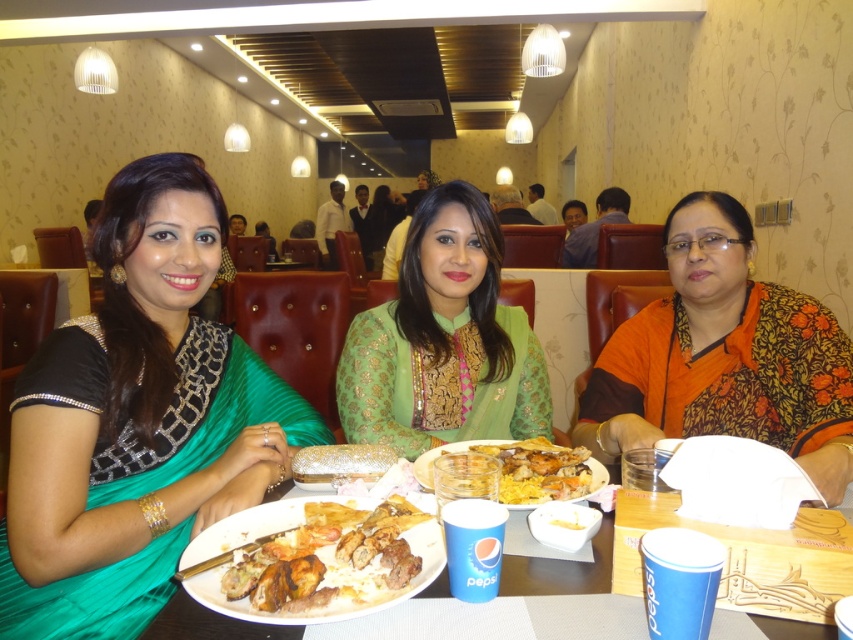
Consider the image. Can you confirm if grilled meat at center is thinner than white paper plate at center?

Correct, grilled meat at center's width is less than white paper plate at center's.

Can you confirm if grilled meat at center is positioned above white paper plate at center?

Yes.

Is point (418, 586) positioned in front of point (524, 586)?

Yes, it is.

Find the location of a particular element. The width and height of the screenshot is (853, 640). grilled meat at center is located at coordinates (338, 573).

Can you confirm if green silk saree at center is wider than grilled meat at center?

Correct, the width of green silk saree at center exceeds that of grilled meat at center.

Is green silk saree at center shorter than grilled meat at center?

In fact, green silk saree at center may be taller than grilled meat at center.

This screenshot has width=853, height=640. I want to click on green silk saree at center, so click(x=137, y=420).

Is grilled meat at center positioned behind translucent glass bowl at center?

No, grilled meat at center is in front of translucent glass bowl at center.

Locate an element on the screen. Image resolution: width=853 pixels, height=640 pixels. grilled meat at center is located at coordinates (338, 573).

This screenshot has height=640, width=853. Find the location of `grilled meat at center`. grilled meat at center is located at coordinates (338, 573).